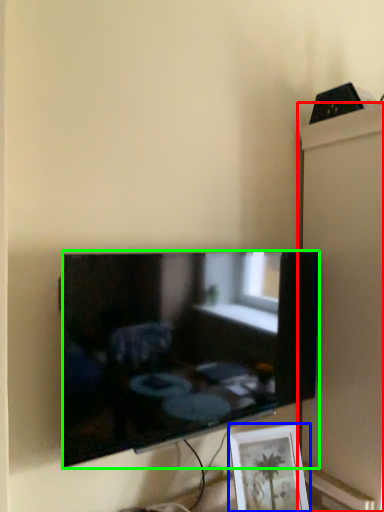
Question: Which object is the closest to the cabinet (highlighted by a red box)? Choose among these: picture frame (highlighted by a blue box) or television (highlighted by a green box).

Choices:
 (A) picture frame
 (B) television

Answer: (B)